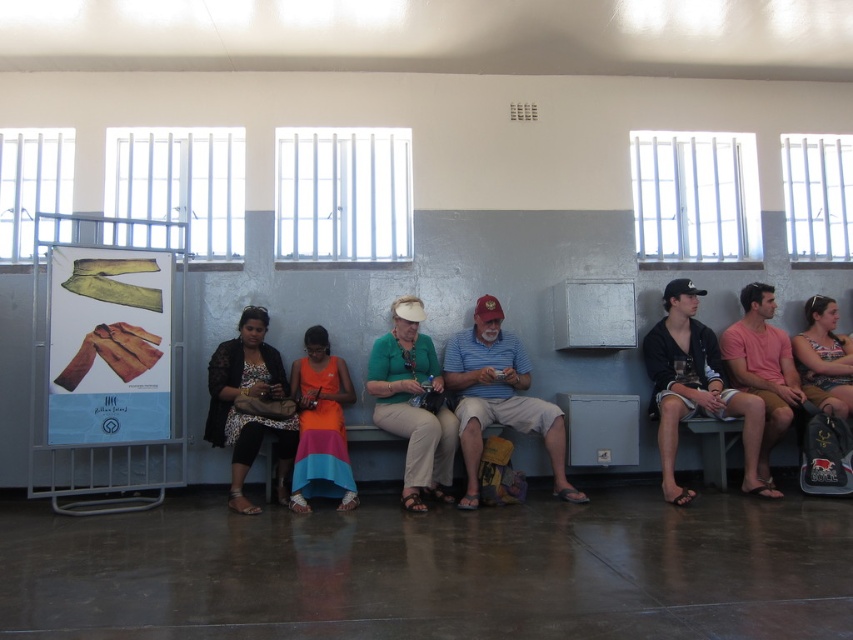
Question: Among these points, which one is farthest from the camera?

Choices:
 (A) (433, 372)
 (B) (582, 499)
 (C) (252, 316)

Answer: (A)

Question: Can you confirm if green matte shirt at center is wider than printed cotton tank top at center?

Choices:
 (A) yes
 (B) no

Answer: (A)

Question: Is black cotton shorts at right positioned behind printed cotton tank top at center?

Choices:
 (A) yes
 (B) no

Answer: (B)

Question: Which point is closer to the camera?

Choices:
 (A) orange fabric dress at center
 (B) black cotton shorts at right
 (C) green matte shirt at center

Answer: (C)

Question: Estimate the real-world distances between objects in this image. Which object is farther from the orange fabric dress at center?

Choices:
 (A) striped cotton shirt at center
 (B) matte black jacket at left

Answer: (A)

Question: Does striped cotton shirt at center appear under orange fabric dress at center?

Choices:
 (A) yes
 (B) no

Answer: (B)